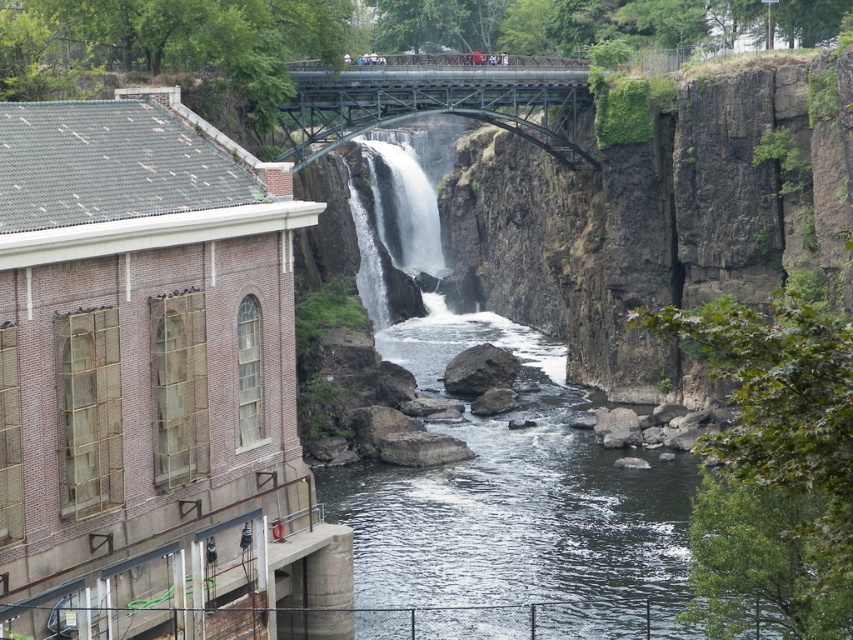
You are standing at a viewpoint near the waterfall and want to know how far the point marked as point (285, 113) is from your current position. Can you determine the distance?

The distance of point (285, 113) from camera is 98.26 meters.

Based on the coordinates provided, which object in the scene is located at point (514, 497)?

The clear water at center is located at point (514, 497).